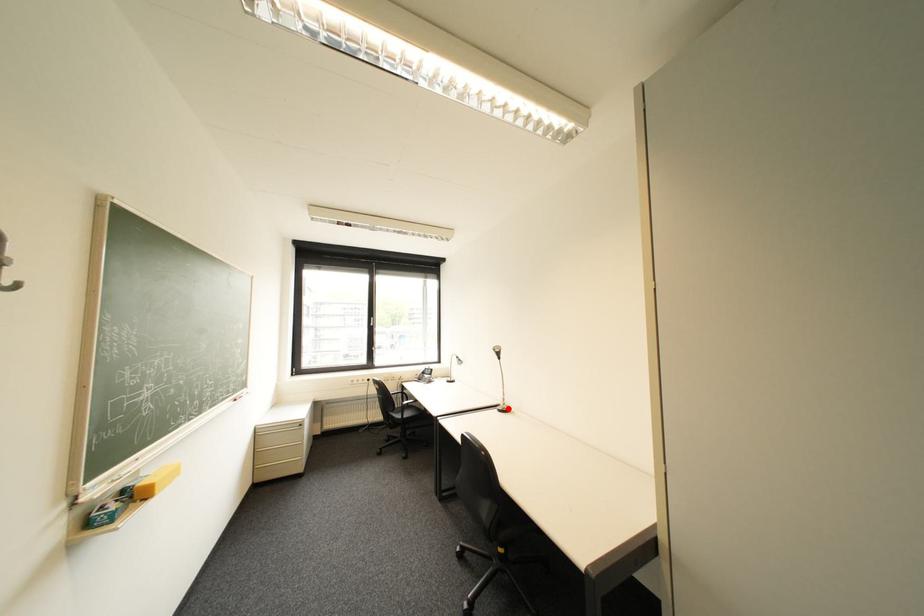
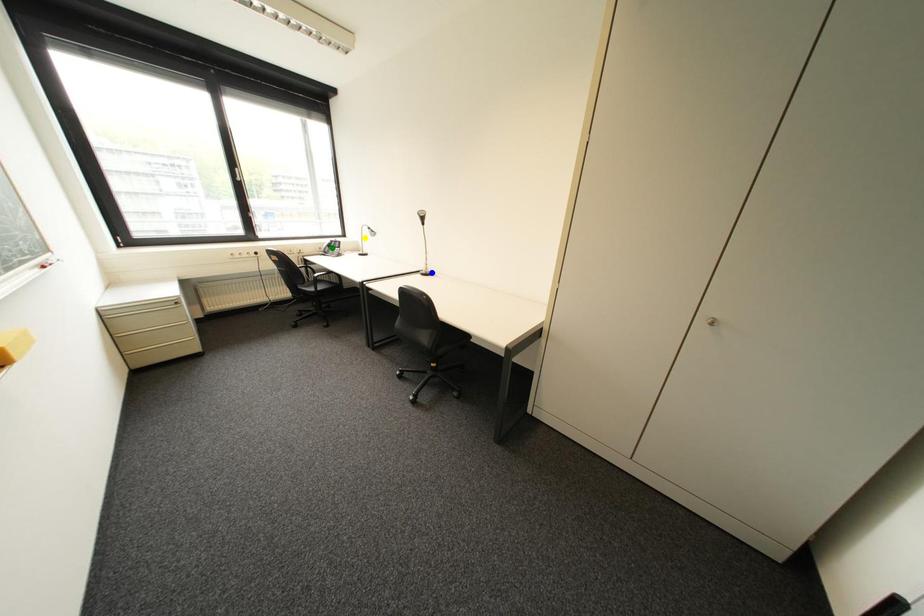
Question: I am providing you with two images of the same scene from different viewpoints. A red point is marked on the first image. You are given multiple points on the second image. Can you choose the point in image 2 that corresponds to the point in image 1?

Choices:
 (A) yellow point
 (B) green point
 (C) blue point

Answer: (C)